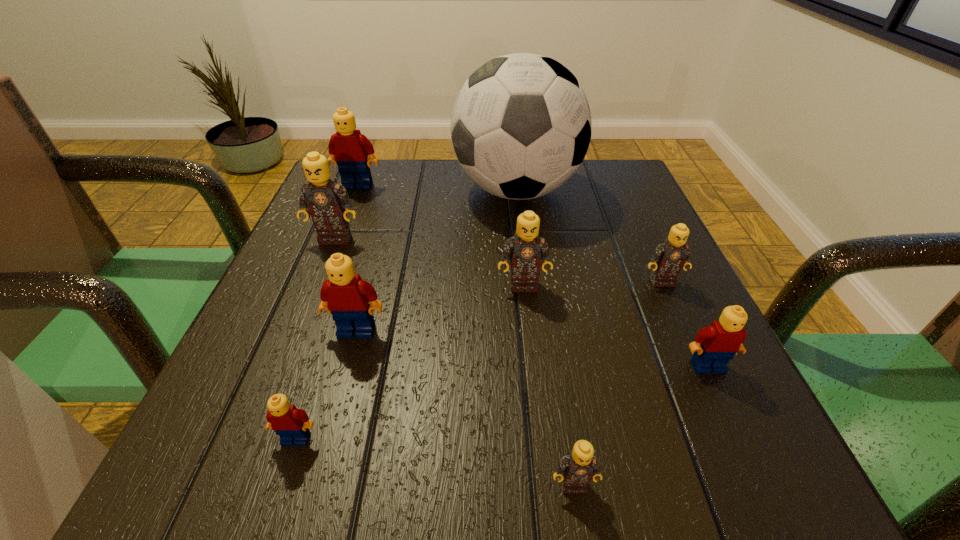
Identify the location of vacant space that's between the third farthest yellow Lego and the seventh nearest Lego. The width and height of the screenshot is (960, 540). (521, 302).

The width and height of the screenshot is (960, 540). I want to click on free space between the nearest object and the biggest tan Lego, so 454,361.

At what (x,y) coordinates should I click in order to perform the action: click on vacant area that lies between the tallest object and the sixth farthest Lego. Please return your answer as a coordinate pair (x, y). The width and height of the screenshot is (960, 540). Looking at the image, I should click on (612, 278).

Find the location of a particular element. This screenshot has width=960, height=540. free point between the third smallest tan Lego and the smallest yellow Lego is located at coordinates (410, 362).

The height and width of the screenshot is (540, 960). What are the coordinates of `blank region between the tallest object and the eighth farthest object` in the screenshot? It's located at (406, 314).

Locate which object is the eighth closest to the third smallest yellow Lego. Please provide its 2D coordinates. Your answer should be formatted as a tuple, i.e. [(x, y)], where the tuple contains the x and y coordinates of a point satisfying the conditions above.

[(715, 345)]

Select which object appears as the eighth closest to the rightmost tan Lego. Please provide its 2D coordinates. Your answer should be formatted as a tuple, i.e. [(x, y)], where the tuple contains the x and y coordinates of a point satisfying the conditions above.

[(349, 149)]

Locate which Lego ranks sixth in proximity to the smallest tan Lego. Please provide its 2D coordinates. Your answer should be formatted as a tuple, i.e. [(x, y)], where the tuple contains the x and y coordinates of a point satisfying the conditions above.

[(327, 201)]

Identify which Lego is located as the third nearest to the third nearest Lego. Please provide its 2D coordinates. Your answer should be formatted as a tuple, i.e. [(x, y)], where the tuple contains the x and y coordinates of a point satisfying the conditions above.

[(525, 250)]

The width and height of the screenshot is (960, 540). What are the coordinates of `yellow Lego that is the fourth closest to the third smallest tan Lego` in the screenshot? It's located at (349, 149).